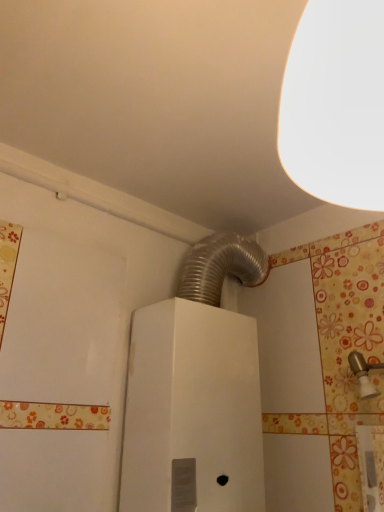
Question: Looking at their shapes, would you say brushed metal faucet at upper right is wider or thinner than white metallic water heater at center?

Choices:
 (A) wide
 (B) thin

Answer: (B)

Question: Is point (362, 362) positioned closer to the camera than point (216, 340)?

Choices:
 (A) farther
 (B) closer

Answer: (B)

Question: Estimate the real-world distances between objects in this image. Which object is farther from the white metallic water heater at center?

Choices:
 (A) brushed metal faucet at upper right
 (B) white matte lampshade at upper right

Answer: (B)

Question: Which is nearer to the white metallic water heater at center?

Choices:
 (A) white matte lampshade at upper right
 (B) brushed metal faucet at upper right

Answer: (B)